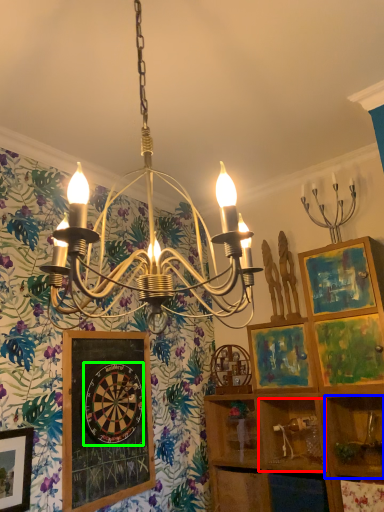
Question: Estimate the real-world distances between objects in this image. Which object is closer to cabinet (highlighted by a red box), shelf (highlighted by a blue box) or design (highlighted by a green box)?

Choices:
 (A) shelf
 (B) design

Answer: (A)